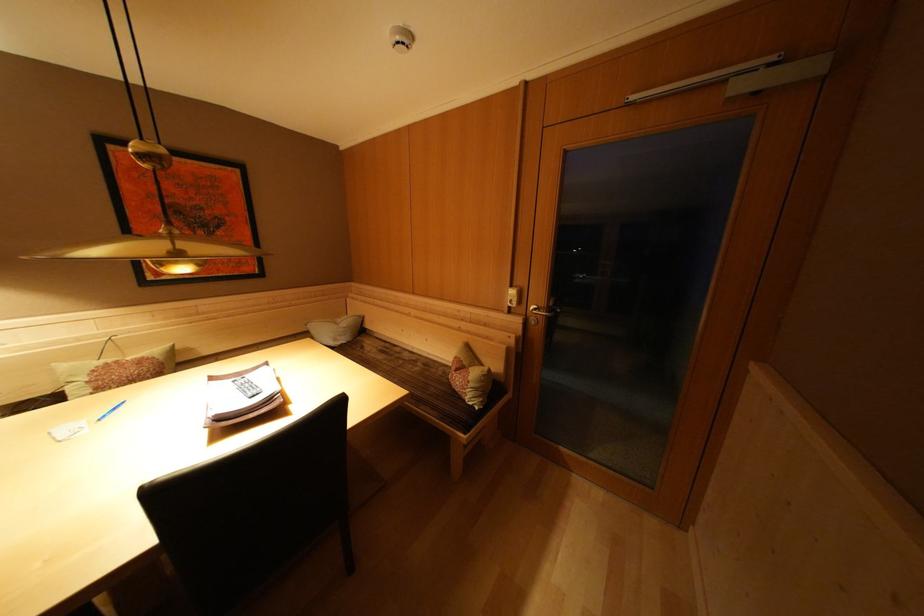
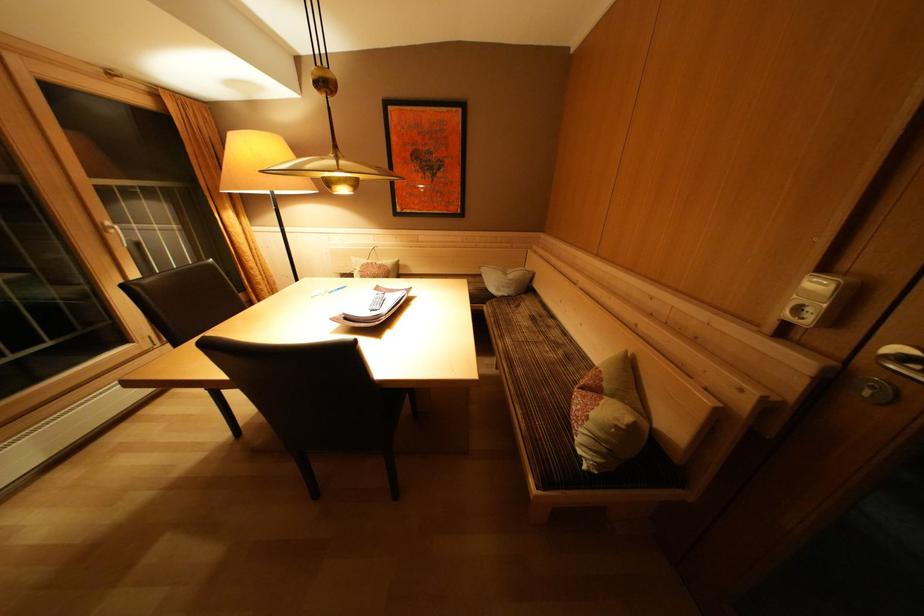
Where in the second image is the point corresponding to the point at 406,358 from the first image?

(555, 331)